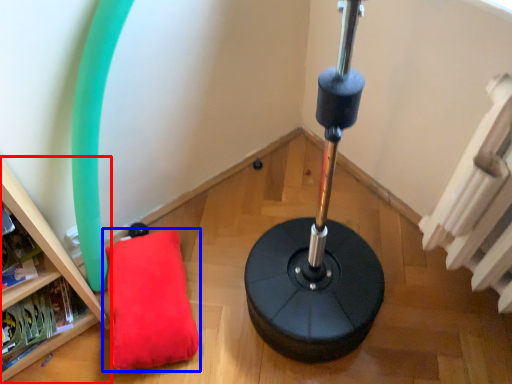
Question: Which of the following is the closest to the observer, furniture (highlighted by a red box) or pillow (highlighted by a blue box)?

Choices:
 (A) furniture
 (B) pillow

Answer: (A)